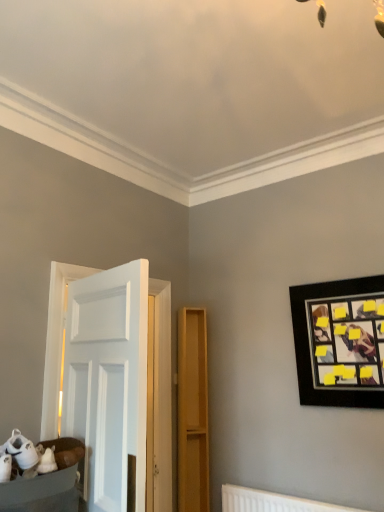
Where is `matte wood dresser at center`? This screenshot has width=384, height=512. matte wood dresser at center is located at coordinates pyautogui.click(x=193, y=411).

Does black matte picture frame at upper right have a lesser width compared to white plastic radiator at lower center?

No, black matte picture frame at upper right is not thinner than white plastic radiator at lower center.

Considering the relative sizes of black matte picture frame at upper right and white plastic radiator at lower center in the image provided, is black matte picture frame at upper right smaller than white plastic radiator at lower center?

Actually, black matte picture frame at upper right might be larger than white plastic radiator at lower center.

Does black matte picture frame at upper right have a lesser height compared to white plastic radiator at lower center?

Incorrect, the height of black matte picture frame at upper right does not fall short of that of white plastic radiator at lower center.

Measure the distance between black matte picture frame at upper right and white plastic radiator at lower center.

1.01 meters.

Is matte wood dresser at center oriented away from white fabric basket at lower left?

matte wood dresser at center is not turned away from white fabric basket at lower left.

Is matte wood dresser at center completely or partially outside of white fabric basket at lower left?

matte wood dresser at center lies outside white fabric basket at lower left's area.

Which object is closer to the camera taking this photo, matte wood dresser at center or white fabric basket at lower left?

white fabric basket at lower left.

Is white plastic radiator at lower center aimed at matte wood dresser at center?

No, white plastic radiator at lower center is not facing towards matte wood dresser at center.

Considering the points (262, 507) and (191, 360), which point is behind, point (262, 507) or point (191, 360)?

The point (191, 360) is farther.

Can we say white plastic radiator at lower center lies outside matte wood dresser at center?

Absolutely, white plastic radiator at lower center is external to matte wood dresser at center.

Between white plastic radiator at lower center and matte wood dresser at center, which one appears on the left side from the viewer's perspective?

matte wood dresser at center is more to the left.

Can you tell me how much matte wood dresser at center and white plastic radiator at lower center differ in facing direction?

57.8 degrees.

Is matte wood dresser at center bigger or smaller than white plastic radiator at lower center?

In the image, matte wood dresser at center appears to be larger than white plastic radiator at lower center.

Looking at their sizes, would you say matte wood dresser at center is wider or thinner than white plastic radiator at lower center?

Clearly, matte wood dresser at center has more width compared to white plastic radiator at lower center.

From the image's perspective, is matte wood dresser at center located above or below white plastic radiator at lower center?

From the image's perspective, matte wood dresser at center appears above white plastic radiator at lower center.

Based on their sizes in the image, would you say white fabric basket at lower left is bigger or smaller than white plastic radiator at lower center?

Considering their sizes, white fabric basket at lower left takes up more space than white plastic radiator at lower center.

Are white fabric basket at lower left and white plastic radiator at lower center located far from each other?

Yes, white fabric basket at lower left is far from white plastic radiator at lower center.

Considering the points (33, 499) and (308, 511), which point is in front, point (33, 499) or point (308, 511)?

Point (33, 499)

Between white fabric basket at lower left and white plastic radiator at lower center, which one has larger width?

Wider between the two is white fabric basket at lower left.

Considering their positions, is black matte picture frame at upper right located in front of or behind matte wood dresser at center?

black matte picture frame at upper right is positioned closer to the viewer than matte wood dresser at center.

Which of these two, black matte picture frame at upper right or matte wood dresser at center, stands shorter?

black matte picture frame at upper right is shorter.

Image resolution: width=384 pixels, height=512 pixels. Find the location of `dresser to the left of black matte picture frame at upper right`. dresser to the left of black matte picture frame at upper right is located at coordinates (193, 411).

Looking at their sizes, would you say black matte picture frame at upper right is wider or thinner than matte wood dresser at center?

Clearly, black matte picture frame at upper right has less width compared to matte wood dresser at center.

Which of these two, white fabric basket at lower left or black matte picture frame at upper right, is smaller?

white fabric basket at lower left.

From the image's perspective, which object appears higher, white fabric basket at lower left or black matte picture frame at upper right?

black matte picture frame at upper right.

Which object is positioned more to the right, white fabric basket at lower left or black matte picture frame at upper right?

black matte picture frame at upper right is more to the right.

Does point (25, 494) appear closer or farther from the camera than point (361, 329)?

Point (25, 494) is positioned closer to the camera compared to point (361, 329).

Find the location of a particular element. This screenshot has height=512, width=384. picture frame on the right of white plastic radiator at lower center is located at coordinates (340, 342).

Where is `dresser lying behind the white fabric basket at lower left`? Image resolution: width=384 pixels, height=512 pixels. dresser lying behind the white fabric basket at lower left is located at coordinates (193, 411).

When comparing their distances from matte wood dresser at center, does white plastic radiator at lower center or white fabric basket at lower left seem further?

white fabric basket at lower left is further to matte wood dresser at center.

Based on their spatial positions, is matte wood dresser at center or white fabric basket at lower left closer to black matte picture frame at upper right?

Based on the image, matte wood dresser at center appears to be nearer to black matte picture frame at upper right.

When comparing their distances from white fabric basket at lower left, does matte wood dresser at center or white plastic radiator at lower center seem closer?

Among the two, matte wood dresser at center is located nearer to white fabric basket at lower left.

Which object lies further to the anchor point matte wood dresser at center, black matte picture frame at upper right or white plastic radiator at lower center?

black matte picture frame at upper right is further to matte wood dresser at center.

Based on the photo, estimate the real-world distances between objects in this image. Which object is further from white fabric basket at lower left, black matte picture frame at upper right or white plastic radiator at lower center?

black matte picture frame at upper right lies further to white fabric basket at lower left than the other object.

From the image, which object appears to be nearer to matte wood dresser at center, white fabric basket at lower left or white plastic radiator at lower center?

white plastic radiator at lower center is closer to matte wood dresser at center.

From the image, which object appears to be farther from white fabric basket at lower left, black matte picture frame at upper right or matte wood dresser at center?

Based on the image, black matte picture frame at upper right appears to be further to white fabric basket at lower left.

Based on their spatial positions, is matte wood dresser at center or white plastic radiator at lower center closer to black matte picture frame at upper right?

white plastic radiator at lower center is positioned closer to the anchor black matte picture frame at upper right.

Find the location of a particular element. This screenshot has height=512, width=384. dresser between white fabric basket at lower left and black matte picture frame at upper right in the horizontal direction is located at coordinates (193, 411).

The width and height of the screenshot is (384, 512). I want to click on radiator located between white fabric basket at lower left and black matte picture frame at upper right in the left-right direction, so click(x=272, y=502).

This screenshot has width=384, height=512. I want to click on dresser between black matte picture frame at upper right and white plastic radiator at lower center from top to bottom, so (x=193, y=411).

The height and width of the screenshot is (512, 384). What are the coordinates of `dresser between white fabric basket at lower left and white plastic radiator at lower center in the horizontal direction` in the screenshot? It's located at (193, 411).